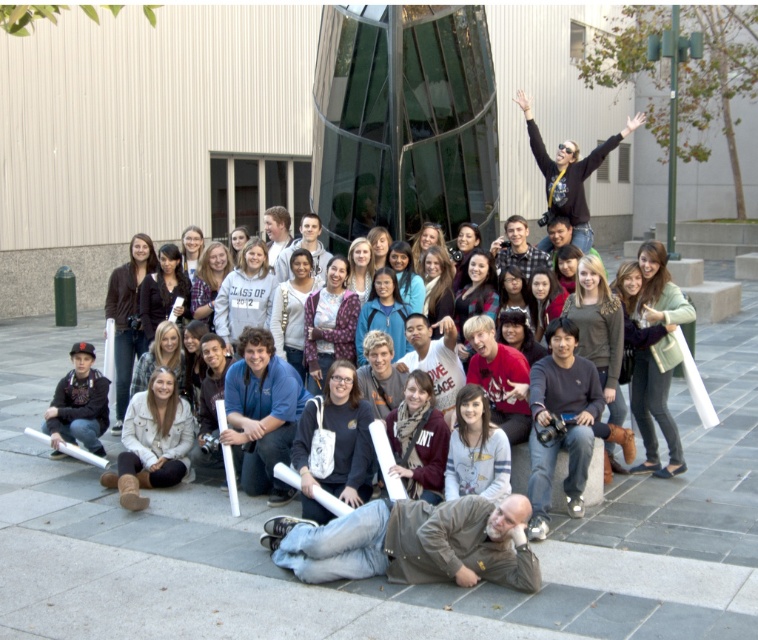
Is brown leather jacket at lower center shorter than matte black jacket at center?

Yes.

Does brown leather jacket at lower center have a greater width compared to matte black jacket at center?

Yes.

Which is in front, point (500, 545) or point (130, 326)?

Point (500, 545)

Locate an element on the screen. This screenshot has height=640, width=758. brown leather jacket at lower center is located at coordinates (417, 544).